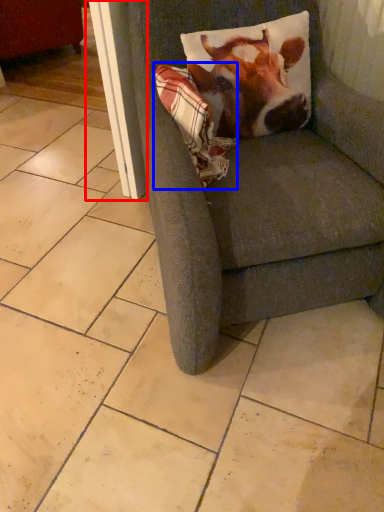
Question: Which object is closer to the camera taking this photo, screen door (highlighted by a red box) or blanket (highlighted by a blue box)?

Choices:
 (A) screen door
 (B) blanket

Answer: (B)